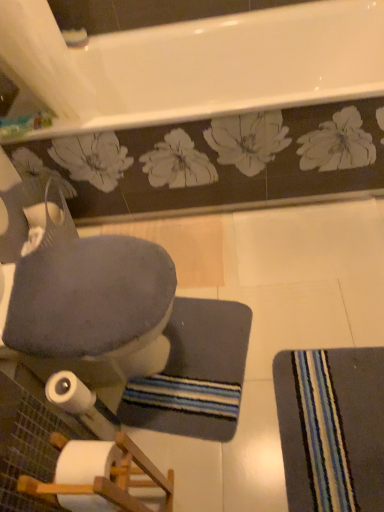
Find the location of `blank space situated above striped fabric mat at lower right (from a real-world perspective)`. blank space situated above striped fabric mat at lower right (from a real-world perspective) is located at coordinates (335, 421).